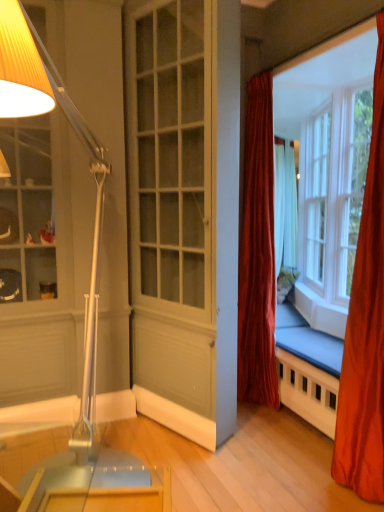
Locate an element on the screen. The image size is (384, 512). velvet red curtain at center, positioned as the 1th curtain in left-to-right order is located at coordinates (257, 252).

This screenshot has width=384, height=512. What do you see at coordinates (257, 252) in the screenshot?
I see `velvet red curtain at center, the 2th curtain when ordered from right to left` at bounding box center [257, 252].

What do you see at coordinates (365, 328) in the screenshot? The image size is (384, 512). I see `silky orange curtain at right, the second curtain positioned from the back` at bounding box center [365, 328].

Image resolution: width=384 pixels, height=512 pixels. What are the coordinates of `metallic silver lamp at left` in the screenshot? It's located at (96, 197).

What do you see at coordinates (172, 215) in the screenshot? The height and width of the screenshot is (512, 384). I see `white painted wood screen door at center` at bounding box center [172, 215].

What are the coordinates of `velvet red curtain at center, the 2th curtain when ordered from right to left` in the screenshot? It's located at (257, 252).

Which is closer, (334, 47) or (266, 318)?

Point (334, 47).

Which of these two, clear glass window at upper right or velvet red curtain at center, placed as the first curtain when sorted from back to front, is smaller?

Smaller between the two is velvet red curtain at center, placed as the first curtain when sorted from back to front.

From a real-world perspective, is clear glass window at upper right on top of velvet red curtain at center, the 2th curtain when ordered from front to back?

Yes, from a real-world perspective, clear glass window at upper right is above velvet red curtain at center, the 2th curtain when ordered from front to back.

Is clear glass window at upper right oriented towards velvet red curtain at center, placed as the first curtain when sorted from back to front?

Yes.

Locate an element on the screen. window above the white painted wood screen door at center (from the image's perspective) is located at coordinates (328, 166).

Between clear glass window at upper right and white painted wood screen door at center, which one has smaller width?

white painted wood screen door at center is thinner.

How far apart are clear glass window at upper right and white painted wood screen door at center?

clear glass window at upper right is 1.59 meters away from white painted wood screen door at center.

Considering the points (319, 191) and (177, 308), which point is behind, point (319, 191) or point (177, 308)?

The point (319, 191) is more distant.

From a real-world perspective, does white painted wood screen door at center sit lower than clear glass window at upper right?

Indeed, from a real-world perspective, white painted wood screen door at center is positioned beneath clear glass window at upper right.

Considering the relative sizes of white painted wood screen door at center and clear glass window at upper right in the image provided, is white painted wood screen door at center bigger than clear glass window at upper right?

Indeed, white painted wood screen door at center has a larger size compared to clear glass window at upper right.

Which object is positioned more to the right, metallic silver lamp at left or clear glass window at upper right?

From the viewer's perspective, clear glass window at upper right appears more on the right side.

Considering the sizes of objects metallic silver lamp at left and clear glass window at upper right in the image provided, who is taller, metallic silver lamp at left or clear glass window at upper right?

metallic silver lamp at left is taller.

In terms of size, does metallic silver lamp at left appear bigger or smaller than clear glass window at upper right?

Considering their sizes, metallic silver lamp at left takes up more space than clear glass window at upper right.

Could you tell me if metallic silver lamp at left is facing clear glass window at upper right?

No, metallic silver lamp at left is not aimed at clear glass window at upper right.

From a real-world perspective, is white painted wood screen door at center located higher than metallic silver lamp at left?

Yes, from a real-world perspective, white painted wood screen door at center is above metallic silver lamp at left.

Looking at their sizes, would you say white painted wood screen door at center is wider or thinner than metallic silver lamp at left?

Considering their sizes, white painted wood screen door at center looks slimmer than metallic silver lamp at left.

Is white painted wood screen door at center positioned with its back to metallic silver lamp at left?

That's not correct — white painted wood screen door at center is not looking away from metallic silver lamp at left.

Is silky orange curtain at right, the second curtain positioned from the back, oriented away from velvet red curtain at center, the 2th curtain when ordered from front to back?

That's not correct — silky orange curtain at right, the second curtain positioned from the back, is not looking away from velvet red curtain at center, the 2th curtain when ordered from front to back.

Is silky orange curtain at right, the 1th curtain from the right, in contact with velvet red curtain at center, placed as the first curtain when sorted from back to front?

There is a gap between silky orange curtain at right, the 1th curtain from the right, and velvet red curtain at center, placed as the first curtain when sorted from back to front.

From the image's perspective, which one is positioned lower, silky orange curtain at right, the second curtain positioned from the back, or velvet red curtain at center, the 2th curtain when ordered from front to back?

From the image's view, silky orange curtain at right, the second curtain positioned from the back, is below.

Which object is more forward, silky orange curtain at right, the 1th curtain from the right, or velvet red curtain at center, placed as the first curtain when sorted from back to front?

Positioned in front is silky orange curtain at right, the 1th curtain from the right.

Consider the image. From the image's perspective, relative to silky orange curtain at right, arranged as the first curtain when viewed from the front, is metallic silver lamp at left above or below?

metallic silver lamp at left is situated lower than silky orange curtain at right, arranged as the first curtain when viewed from the front, in the image.

Is metallic silver lamp at left thinner than silky orange curtain at right, arranged as the first curtain when viewed from the front?

No.

Does metallic silver lamp at left have a greater height compared to silky orange curtain at right, the second curtain positioned from the back?

In fact, metallic silver lamp at left may be shorter than silky orange curtain at right, the second curtain positioned from the back.

From the clear glass window at upper right, count the 2nd curtain to the left and point to it. Please provide its 2D coordinates.

[(257, 252)]

Identify the location of window behind the white painted wood screen door at center. Image resolution: width=384 pixels, height=512 pixels. (328, 166).

Estimate the real-world distances between objects in this image. Which object is further from clear glass window at upper right, silky orange curtain at right, arranged as the first curtain when viewed from the front, or white painted wood screen door at center?

silky orange curtain at right, arranged as the first curtain when viewed from the front, is further to clear glass window at upper right.

From the image, which object appears to be nearer to clear glass window at upper right, silky orange curtain at right, the second curtain positioned from the back, or velvet red curtain at center, placed as the first curtain when sorted from back to front?

velvet red curtain at center, placed as the first curtain when sorted from back to front, is positioned closer to the anchor clear glass window at upper right.

Based on the photo, from the image, which object appears to be farther from white painted wood screen door at center, silky orange curtain at right, arranged as the first curtain when viewed from the front, or metallic silver lamp at left?

Among the two, silky orange curtain at right, arranged as the first curtain when viewed from the front, is located further to white painted wood screen door at center.

When comparing their distances from velvet red curtain at center, the 2th curtain when ordered from front to back, does metallic silver lamp at left or white painted wood screen door at center seem further?

The object further to velvet red curtain at center, the 2th curtain when ordered from front to back, is metallic silver lamp at left.

Which object lies further to the anchor point velvet red curtain at center, placed as the first curtain when sorted from back to front, silky orange curtain at right, the 1th curtain from the right, or white painted wood screen door at center?

Based on the image, silky orange curtain at right, the 1th curtain from the right, appears to be further to velvet red curtain at center, placed as the first curtain when sorted from back to front.

Estimate the real-world distances between objects in this image. Which object is further from white painted wood screen door at center, velvet red curtain at center, placed as the first curtain when sorted from back to front, or metallic silver lamp at left?

Among the two, velvet red curtain at center, placed as the first curtain when sorted from back to front, is located further to white painted wood screen door at center.

Looking at this image, estimate the real-world distances between objects in this image. Which object is further from velvet red curtain at center, positioned as the 1th curtain in left-to-right order, clear glass window at upper right or white painted wood screen door at center?

The object further to velvet red curtain at center, positioned as the 1th curtain in left-to-right order, is clear glass window at upper right.

Considering their positions, is metallic silver lamp at left positioned closer to clear glass window at upper right than velvet red curtain at center, placed as the first curtain when sorted from back to front?

velvet red curtain at center, placed as the first curtain when sorted from back to front, is positioned closer to the anchor clear glass window at upper right.

Where is `curtain between metallic silver lamp at left and velvet red curtain at center, positioned as the 1th curtain in left-to-right order, along the z-axis`? curtain between metallic silver lamp at left and velvet red curtain at center, positioned as the 1th curtain in left-to-right order, along the z-axis is located at coordinates (365, 328).

You are a GUI agent. You are given a task and a screenshot of the screen. Output one action in this format:
    pyautogui.click(x=<x>, y=<y>)
    Task: Click on the curtain located between silky orange curtain at right, which is counted as the 2th curtain, starting from the left, and clear glass window at upper right in the depth direction
    
    Given the screenshot: What is the action you would take?
    pyautogui.click(x=257, y=252)

Where is `screen door positioned between metallic silver lamp at left and velvet red curtain at center, the 2th curtain when ordered from right to left, from near to far`? screen door positioned between metallic silver lamp at left and velvet red curtain at center, the 2th curtain when ordered from right to left, from near to far is located at coordinates point(172,215).

Locate an element on the screen. The width and height of the screenshot is (384, 512). screen door between silky orange curtain at right, which is counted as the 2th curtain, starting from the left, and velvet red curtain at center, the 2th curtain when ordered from front to back, along the z-axis is located at coordinates (172, 215).